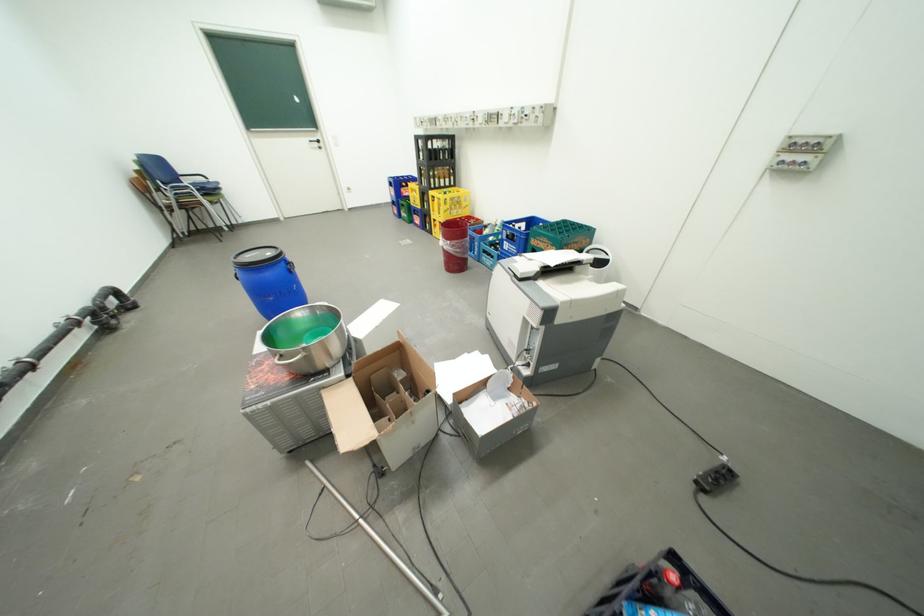
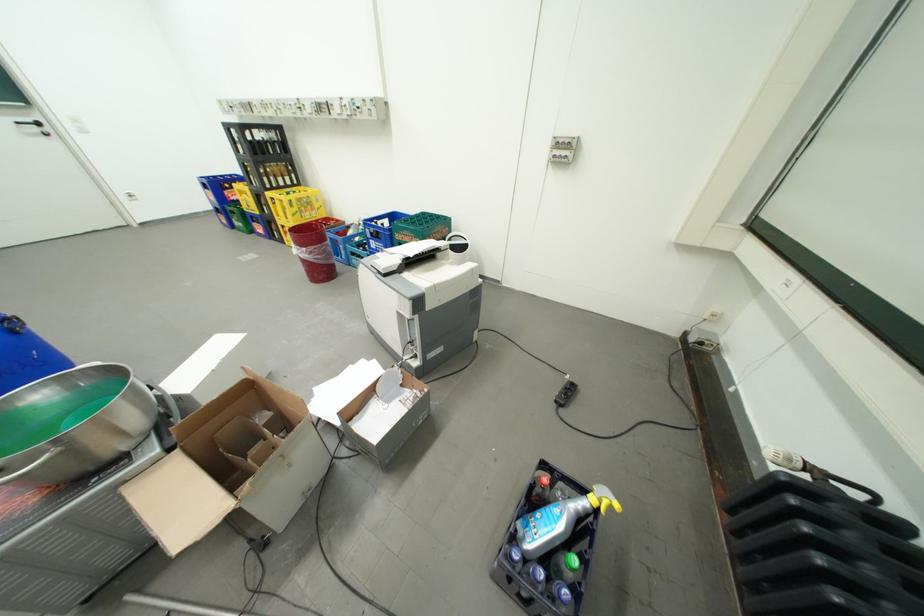
The point at (459, 243) is marked in the first image. Where is the corresponding point in the second image?

(314, 249)